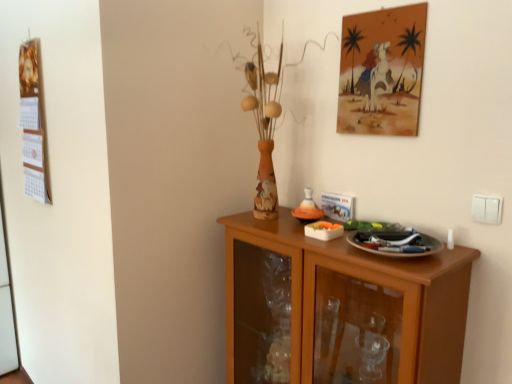
Question: Should I look upward or downward to see wooden cabinet at lower right?

Choices:
 (A) down
 (B) up

Answer: (A)

Question: From the image's perspective, would you say wooden calendar at left is shown under wooden cabinet at lower right?

Choices:
 (A) yes
 (B) no

Answer: (B)

Question: Can you confirm if wooden calendar at left is positioned to the right of wooden cabinet at lower right?

Choices:
 (A) no
 (B) yes

Answer: (A)

Question: From a real-world perspective, does wooden calendar at left sit lower than wooden cabinet at lower right?

Choices:
 (A) yes
 (B) no

Answer: (B)

Question: Considering the relative positions of wooden calendar at left and wooden cabinet at lower right in the image provided, is wooden calendar at left to the left of wooden cabinet at lower right from the viewer's perspective?

Choices:
 (A) no
 (B) yes

Answer: (B)

Question: Does wooden calendar at left have a lesser height compared to wooden cabinet at lower right?

Choices:
 (A) no
 (B) yes

Answer: (B)

Question: Is wooden calendar at left aimed at wooden cabinet at lower right?

Choices:
 (A) yes
 (B) no

Answer: (B)

Question: Is watercolor painting at upper right shorter than wooden cabinet at lower right?

Choices:
 (A) no
 (B) yes

Answer: (B)

Question: Is there a large distance between watercolor painting at upper right and wooden cabinet at lower right?

Choices:
 (A) no
 (B) yes

Answer: (A)

Question: Considering the relative positions of watercolor painting at upper right and wooden cabinet at lower right in the image provided, is watercolor painting at upper right in front of wooden cabinet at lower right?

Choices:
 (A) no
 (B) yes

Answer: (A)

Question: Is watercolor painting at upper right wider than wooden cabinet at lower right?

Choices:
 (A) yes
 (B) no

Answer: (B)

Question: Is watercolor painting at upper right bigger than wooden cabinet at lower right?

Choices:
 (A) yes
 (B) no

Answer: (B)

Question: Is watercolor painting at upper right oriented towards wooden cabinet at lower right?

Choices:
 (A) yes
 (B) no

Answer: (B)

Question: Is watercolor painting at upper right positioned in front of white plastic switch at right?

Choices:
 (A) yes
 (B) no

Answer: (B)